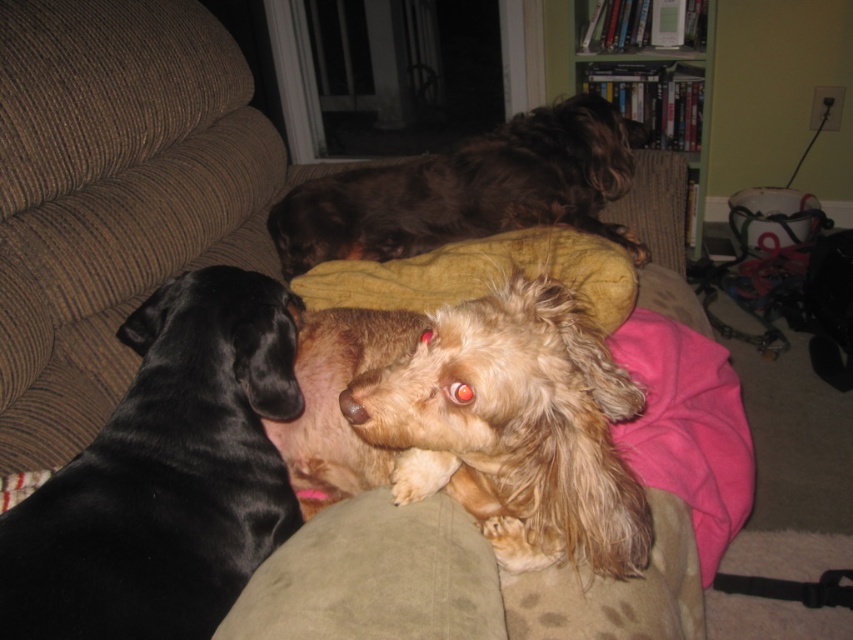
Does fuzzy brown dog at center have a larger size compared to shiny brown fur at upper center?

Actually, fuzzy brown dog at center might be smaller than shiny brown fur at upper center.

Who is more forward, [451,381] or [621,147]?

Point [451,381] is more forward.

At what (x,y) coordinates should I click in order to perform the action: click on fuzzy brown dog at center. Please return your answer as a coordinate pair (x, y). Image resolution: width=853 pixels, height=640 pixels. Looking at the image, I should click on (514, 428).

What do you see at coordinates (166, 476) in the screenshot? The height and width of the screenshot is (640, 853). I see `black shiny dog at left` at bounding box center [166, 476].

Is black shiny dog at left positioned behind fuzzy brown dog at center?

No, black shiny dog at left is in front of fuzzy brown dog at center.

Describe the element at coordinates (166, 476) in the screenshot. I see `black shiny dog at left` at that location.

Where is `black shiny dog at left`? Image resolution: width=853 pixels, height=640 pixels. black shiny dog at left is located at coordinates (166, 476).

Can you confirm if black shiny dog at left is positioned above shiny brown fur at upper center?

Incorrect, black shiny dog at left is not positioned above shiny brown fur at upper center.

Does point (199, 426) lie in front of point (314, 260)?

That is True.

Is point (26, 538) farther from viewer compared to point (299, 257)?

No, (26, 538) is closer to viewer.

Where is `black shiny dog at left`? The image size is (853, 640). black shiny dog at left is located at coordinates (166, 476).